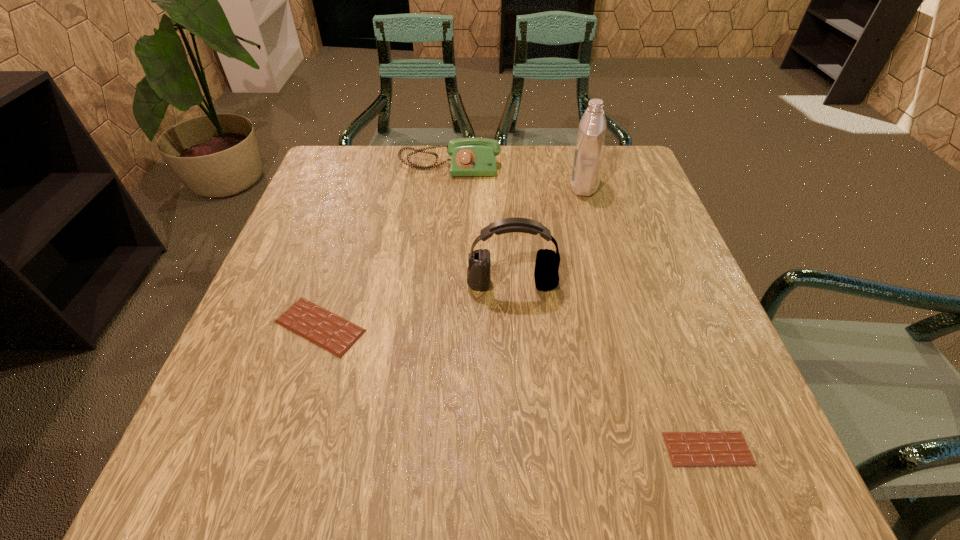
You are a GUI agent. You are given a task and a screenshot of the screen. Output one action in this format:
    pyautogui.click(x=<x>, y=<y>)
    Task: Click on the free space located 0.250m on the dial of the third shortest object
    This screenshot has height=540, width=960.
    Given the screenshot: What is the action you would take?
    pyautogui.click(x=444, y=241)

I want to click on vacant region located 0.250m on the right of the left chocolate bar, so click(x=500, y=326).

Locate an element on the screen. This screenshot has height=540, width=960. free space located 0.170m on the back of the shorter chocolate bar is located at coordinates (669, 342).

The width and height of the screenshot is (960, 540). I want to click on detergent at the far edge, so click(x=589, y=148).

Where is `telephone present at the far edge`? telephone present at the far edge is located at coordinates (469, 156).

Find the location of a particular element. The image size is (960, 540). object located at the near edge is located at coordinates (717, 448).

Locate an element on the screen. object situated at the left edge is located at coordinates [327, 330].

At what (x,y) coordinates should I click in order to perform the action: click on detergent that is positioned at the right edge. Please return your answer as a coordinate pair (x, y). This screenshot has width=960, height=540. Looking at the image, I should click on click(x=589, y=148).

You are a GUI agent. You are given a task and a screenshot of the screen. Output one action in this format:
    pyautogui.click(x=<x>, y=<y>)
    Task: Click on the chocolate bar present at the right edge
    This screenshot has height=540, width=960.
    Given the screenshot: What is the action you would take?
    pyautogui.click(x=717, y=448)

Find the location of a particular element. object located in the far right corner section of the desktop is located at coordinates (589, 148).